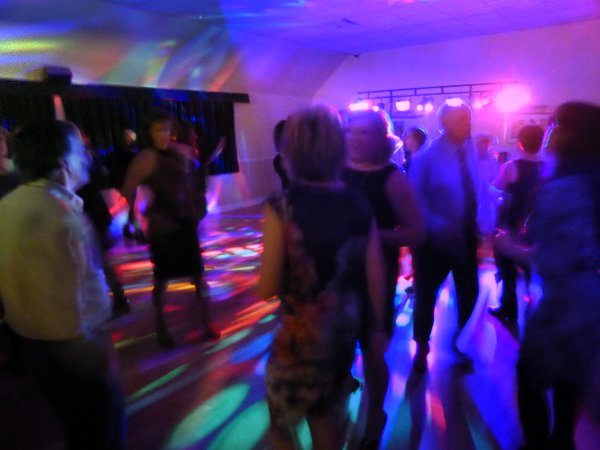
Where is `floor`? The height and width of the screenshot is (450, 600). floor is located at coordinates (181, 391).